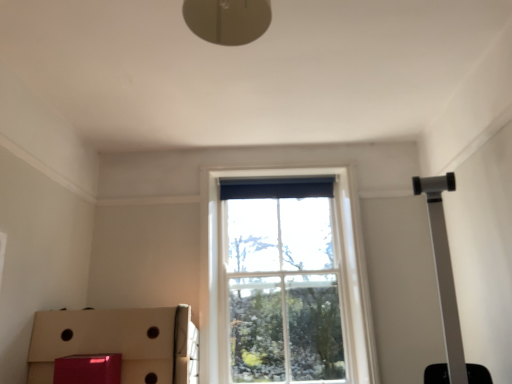
Question: Is cardboard box at lower left at the left side of clear glass window at center?

Choices:
 (A) no
 (B) yes

Answer: (B)

Question: Is clear glass window at center completely or partially inside cardboard box at lower left?

Choices:
 (A) no
 (B) yes

Answer: (A)

Question: From a real-world perspective, is cardboard box at lower left beneath clear glass window at center?

Choices:
 (A) no
 (B) yes

Answer: (B)

Question: Does cardboard box at lower left have a greater height compared to clear glass window at center?

Choices:
 (A) no
 (B) yes

Answer: (A)

Question: Is cardboard box at lower left not inside clear glass window at center?

Choices:
 (A) yes
 (B) no

Answer: (A)

Question: From a real-world perspective, is cardboard box at lower left on top of clear glass window at center?

Choices:
 (A) no
 (B) yes

Answer: (A)

Question: Considering the relative positions of clear glass window at center and cardboard box at lower left in the image provided, is clear glass window at center to the left of cardboard box at lower left from the viewer's perspective?

Choices:
 (A) yes
 (B) no

Answer: (B)

Question: Does clear glass window at center appear on the right side of cardboard box at lower left?

Choices:
 (A) no
 (B) yes

Answer: (B)

Question: Would you say clear glass window at center is outside cardboard box at lower left?

Choices:
 (A) yes
 (B) no

Answer: (A)

Question: Is clear glass window at center in front of cardboard box at lower left?

Choices:
 (A) yes
 (B) no

Answer: (B)

Question: From a real-world perspective, is clear glass window at center on cardboard box at lower left?

Choices:
 (A) yes
 (B) no

Answer: (A)

Question: Is clear glass window at center not near cardboard box at lower left?

Choices:
 (A) yes
 (B) no

Answer: (B)

Question: Is cardboard box at lower left spatially inside clear glass window at center, or outside of it?

Choices:
 (A) inside
 (B) outside

Answer: (B)